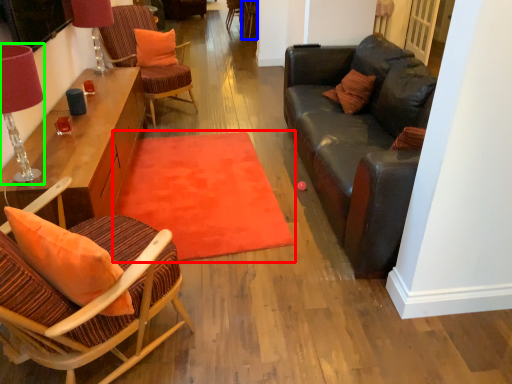
Question: Which is nearer to the mat (highlighted by a red box)? armchair (highlighted by a blue box) or table lamp (highlighted by a green box).

Choices:
 (A) armchair
 (B) table lamp

Answer: (B)